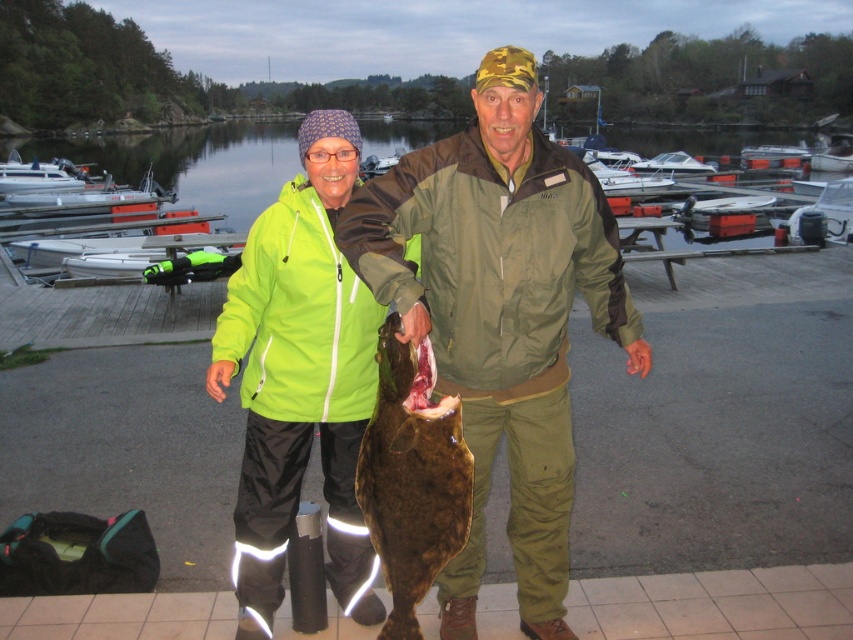
Which is above, brown rough fish at center or clear water at center?

clear water at center is higher up.

Who is shorter, brown rough fish at center or clear water at center?

Standing shorter between the two is brown rough fish at center.

At what (x,y) coordinates should I click in order to perform the action: click on brown rough fish at center. Please return your answer as a coordinate pair (x, y). Looking at the image, I should click on (412, 477).

From the picture: Between green matte jacket at center and brown rough fish at center, which one is positioned higher?

green matte jacket at center

Is green matte jacket at center smaller than brown rough fish at center?

Incorrect, green matte jacket at center is not smaller in size than brown rough fish at center.

This screenshot has height=640, width=853. What do you see at coordinates (500, 314) in the screenshot? I see `green matte jacket at center` at bounding box center [500, 314].

Locate an element on the screen. This screenshot has width=853, height=640. green matte jacket at center is located at coordinates (500, 314).

Between point (177, 172) and point (695, 163), which one is positioned in front?

Point (695, 163) is in front.

Can you confirm if clear water at center is positioned to the left of white plastic boat at upper center?

Correct, you'll find clear water at center to the left of white plastic boat at upper center.

In order to click on clear water at center in this screenshot , I will do `click(193, 164)`.